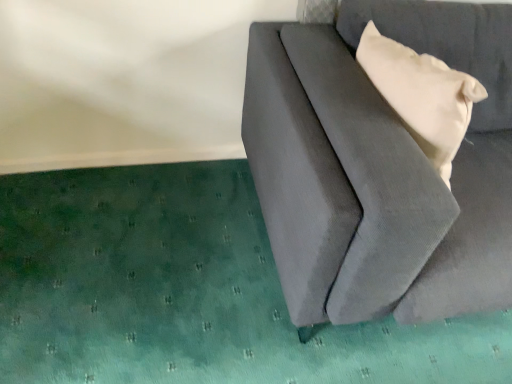
Locate an element on the screen. This screenshot has width=512, height=384. suede gray couch at right is located at coordinates (380, 168).

What is the approximate width of suede gray couch at right?

1.05 meters.

Image resolution: width=512 pixels, height=384 pixels. What do you see at coordinates (380, 168) in the screenshot? I see `suede gray couch at right` at bounding box center [380, 168].

What is the approximate height of suede gray couch at right?

The height of suede gray couch at right is 30.70 inches.

What do you see at coordinates (422, 95) in the screenshot?
I see `matte beige pillow at upper right` at bounding box center [422, 95].

Locate an element on the screen. matte beige pillow at upper right is located at coordinates (422, 95).

You are a GUI agent. You are given a task and a screenshot of the screen. Output one action in this format:
    pyautogui.click(x=<x>, y=<y>)
    Task: Click on the suede gray couch at right
    
    Given the screenshot: What is the action you would take?
    pyautogui.click(x=380, y=168)

Which is more to the left, matte beige pillow at upper right or suede gray couch at right?

Positioned to the left is matte beige pillow at upper right.

Relative to suede gray couch at right, is matte beige pillow at upper right in front or behind?

In the image, matte beige pillow at upper right appears behind suede gray couch at right.

Is point (412, 105) closer or farther from the camera than point (259, 23)?

Point (412, 105) appears to be closer to the viewer than point (259, 23).

From the image's perspective, which is above, matte beige pillow at upper right or suede gray couch at right?

matte beige pillow at upper right.

From a real-world perspective, which is physically above, matte beige pillow at upper right or suede gray couch at right?

matte beige pillow at upper right is physically above.

Which object is wider, matte beige pillow at upper right or suede gray couch at right?

Wider between the two is suede gray couch at right.

From their relative heights in the image, would you say matte beige pillow at upper right is taller or shorter than suede gray couch at right?

Clearly, matte beige pillow at upper right is shorter compared to suede gray couch at right.

Looking at this image, based on their sizes in the image, would you say matte beige pillow at upper right is bigger or smaller than suede gray couch at right?

In the image, matte beige pillow at upper right appears to be smaller than suede gray couch at right.

Is matte beige pillow at upper right inside or outside of suede gray couch at right?

matte beige pillow at upper right is enclosed within suede gray couch at right.

Is matte beige pillow at upper right directly adjacent to suede gray couch at right?

They are not placed beside each other.

Is matte beige pillow at upper right oriented towards suede gray couch at right?

Yes, matte beige pillow at upper right is oriented towards suede gray couch at right.

Find the location of a particular element. pillow behind the suede gray couch at right is located at coordinates (422, 95).

Considering the positions of objects suede gray couch at right and matte beige pillow at upper right in the image provided, who is more to the left, suede gray couch at right or matte beige pillow at upper right?

matte beige pillow at upper right.

Consider the image. Which object is further away from the camera taking this photo, suede gray couch at right or matte beige pillow at upper right?

matte beige pillow at upper right.

Does point (504, 193) lie behind point (375, 32)?

That is True.

From the image's perspective, which one is positioned higher, suede gray couch at right or matte beige pillow at upper right?

matte beige pillow at upper right is shown above in the image.

From a real-world perspective, is suede gray couch at right under matte beige pillow at upper right?

Yes, from a real-world perspective, suede gray couch at right is under matte beige pillow at upper right.

In the scene shown: Can you confirm if suede gray couch at right is wider than matte beige pillow at upper right?

Indeed, suede gray couch at right has a greater width compared to matte beige pillow at upper right.

Is suede gray couch at right taller than matte beige pillow at upper right?

Indeed, suede gray couch at right has a greater height compared to matte beige pillow at upper right.

Between suede gray couch at right and matte beige pillow at upper right, which one has larger size?

suede gray couch at right is bigger.

Is matte beige pillow at upper right surrounded by suede gray couch at right?

Yes, matte beige pillow at upper right is a part of suede gray couch at right.

Would you consider suede gray couch at right to be distant from matte beige pillow at upper right?

No.

Is matte beige pillow at upper right at the back of suede gray couch at right?

Yes.

What's the angular difference between suede gray couch at right and matte beige pillow at upper right's facing directions?

suede gray couch at right and matte beige pillow at upper right are facing 4.06 degrees away from each other.

Find the location of a particular element. The width and height of the screenshot is (512, 384). furniture on the right of matte beige pillow at upper right is located at coordinates (380, 168).

Find the location of a particular element. Image resolution: width=512 pixels, height=384 pixels. pillow behind the suede gray couch at right is located at coordinates (422, 95).

The height and width of the screenshot is (384, 512). I want to click on furniture on the right of matte beige pillow at upper right, so click(380, 168).